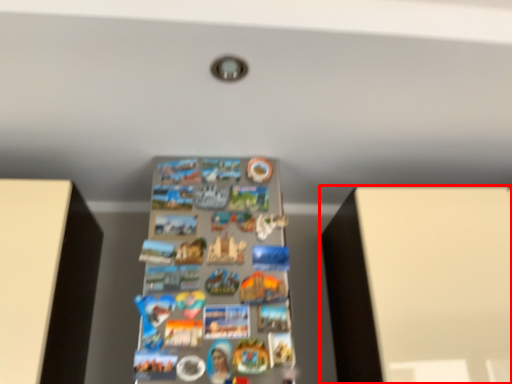
Question: Observing the image, what is the correct spatial positioning of furniture (annotated by the red box) in reference to shelf?

Choices:
 (A) right
 (B) left

Answer: (A)